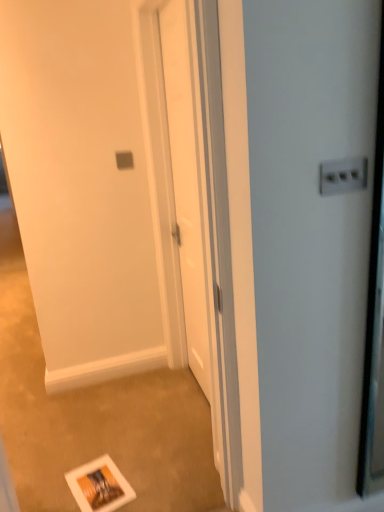
Question: From the image's perspective, is white glossy screen door at lower center, which appears as the first screen door when viewed from the front, over white glossy door at center, positioned as the 2th screen door in front-to-back order?

Choices:
 (A) no
 (B) yes

Answer: (A)

Question: Is white glossy screen door at lower center, the 2th screen door in the back-to-front sequence, further to the viewer compared to white glossy door at center, which is the 1th screen door in back-to-front order?

Choices:
 (A) yes
 (B) no

Answer: (B)

Question: Is white glossy screen door at lower center, which appears as the first screen door when viewed from the front, positioned with its back to white glossy door at center, which is the 1th screen door in back-to-front order?

Choices:
 (A) yes
 (B) no

Answer: (A)

Question: Could you tell me if white glossy screen door at lower center, the 2th screen door in the back-to-front sequence, is turned towards white glossy door at center, which is the 1th screen door in back-to-front order?

Choices:
 (A) no
 (B) yes

Answer: (A)

Question: Is white glossy screen door at lower center, the 2th screen door in the back-to-front sequence, beside white glossy door at center, which is the 1th screen door in back-to-front order?

Choices:
 (A) yes
 (B) no

Answer: (B)

Question: Considering the relative positions of white glossy screen door at lower center, which appears as the first screen door when viewed from the front, and white glossy door at center, which is the 1th screen door in back-to-front order, in the image provided, is white glossy screen door at lower center, which appears as the first screen door when viewed from the front, to the right of white glossy door at center, which is the 1th screen door in back-to-front order, from the viewer's perspective?

Choices:
 (A) yes
 (B) no

Answer: (B)

Question: From the image's perspective, is white glossy door at center, which is the 1th screen door in back-to-front order, on top of white glossy screen door at lower center, the 2th screen door in the back-to-front sequence?

Choices:
 (A) no
 (B) yes

Answer: (B)

Question: Is white glossy screen door at lower center, which appears as the first screen door when viewed from the front, at the back of white glossy door at center, which is the 1th screen door in back-to-front order?

Choices:
 (A) no
 (B) yes

Answer: (A)

Question: Considering the relative sizes of white glossy door at center, positioned as the 2th screen door in front-to-back order, and white glossy screen door at lower center, the 2th screen door in the back-to-front sequence, in the image provided, is white glossy door at center, positioned as the 2th screen door in front-to-back order, smaller than white glossy screen door at lower center, the 2th screen door in the back-to-front sequence,?

Choices:
 (A) yes
 (B) no

Answer: (B)

Question: Can you confirm if white glossy door at center, positioned as the 2th screen door in front-to-back order, is shorter than white glossy screen door at lower center, the 2th screen door in the back-to-front sequence?

Choices:
 (A) no
 (B) yes

Answer: (A)

Question: Can you confirm if white glossy door at center, positioned as the 2th screen door in front-to-back order, is positioned to the left of white glossy screen door at lower center, which appears as the first screen door when viewed from the front?

Choices:
 (A) no
 (B) yes

Answer: (A)

Question: Is white glossy door at center, which is the 1th screen door in back-to-front order, thinner than white glossy screen door at lower center, the 2th screen door in the back-to-front sequence?

Choices:
 (A) no
 (B) yes

Answer: (B)

Question: Is white matte postcard at lower center bigger than white glossy screen door at lower center, the 2th screen door in the back-to-front sequence?

Choices:
 (A) yes
 (B) no

Answer: (B)